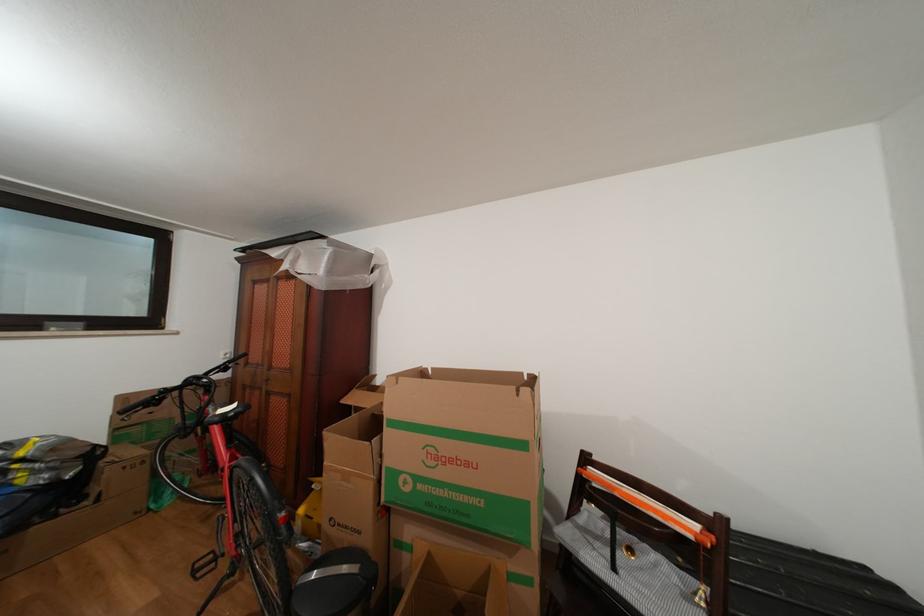
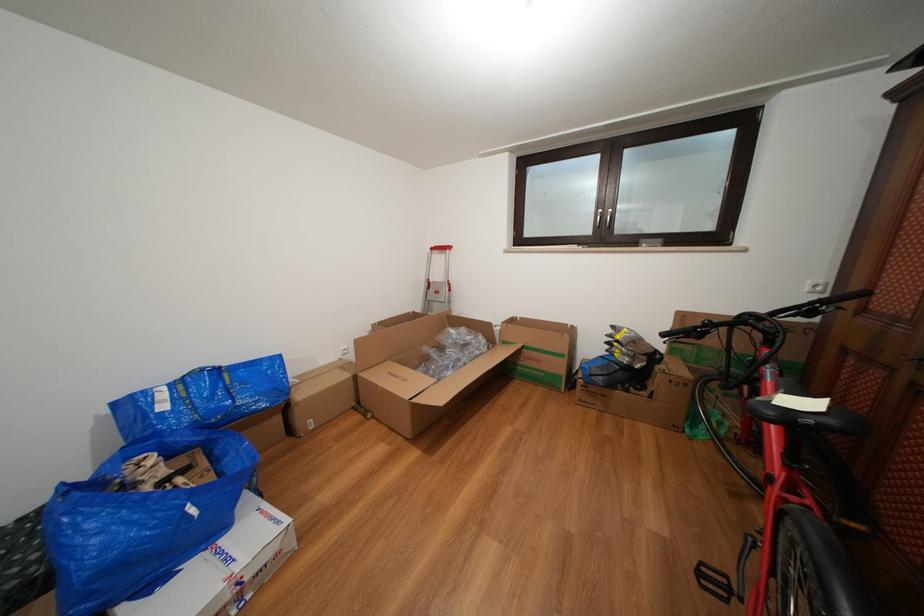
Where in the second image is the point corresponding to point (162, 402) from the first image?

(703, 333)